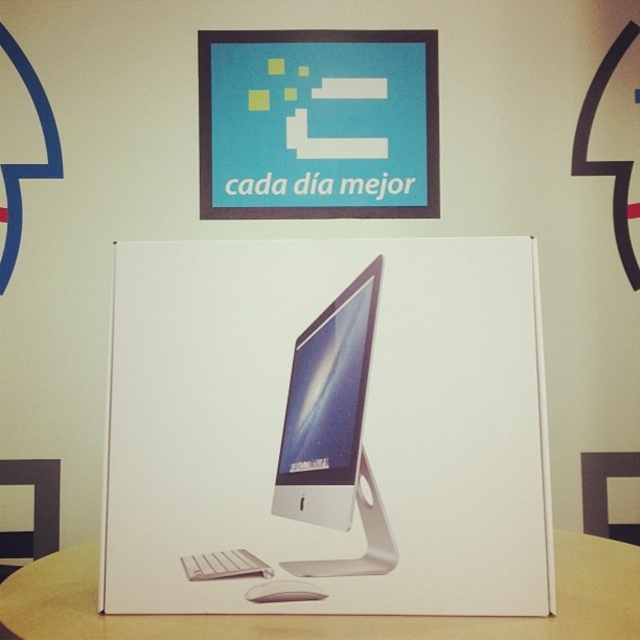
Which is in front, point (310, 400) or point (250, 596)?

Point (250, 596) is more forward.

Is point (314, 378) in front of point (310, 593)?

No, it is behind (310, 593).

Where is `satin silver monitor at center`? satin silver monitor at center is located at coordinates (326, 408).

Which is more to the right, white glossy desktop computer at center or white plastic mouse at lower center?

white glossy desktop computer at center is more to the right.

What do you see at coordinates (326, 428) in the screenshot? I see `white glossy desktop computer at center` at bounding box center [326, 428].

The width and height of the screenshot is (640, 640). What are the coordinates of `white glossy desktop computer at center` in the screenshot? It's located at (326, 428).

Describe the element at coordinates (326, 428) in the screenshot. This screenshot has height=640, width=640. I see `white glossy desktop computer at center` at that location.

Is white glossy desktop computer at center further to camera compared to wooden table at center?

Yes, it is behind wooden table at center.

Does point (369, 492) come closer to viewer compared to point (522, 624)?

No, (369, 492) is further to viewer.

The image size is (640, 640). Find the location of `white glossy desktop computer at center`. white glossy desktop computer at center is located at coordinates [x=326, y=428].